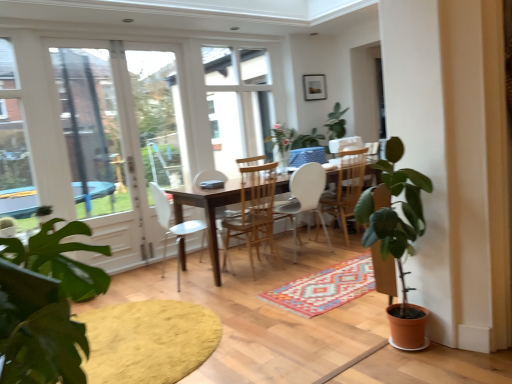
Image resolution: width=512 pixels, height=384 pixels. What do you see at coordinates (100, 153) in the screenshot?
I see `clear glass screen door at left` at bounding box center [100, 153].

Measure the distance between wooden chair at center, the 3th chair when ordered from right to left, and camera.

wooden chair at center, the 3th chair when ordered from right to left, and camera are 3.44 meters apart.

Image resolution: width=512 pixels, height=384 pixels. Identify the location of yellow felt mat at lower center. (149, 341).

At what (x,y) coordinates should I click in order to perform the action: click on clear glass screen door at left. Please return your answer as a coordinate pair (x, y). The height and width of the screenshot is (384, 512). Looking at the image, I should click on (100, 153).

Who is taller, wooden chair at center, the 3th chair when ordered from right to left, or white plastic chair at center, the 4th chair in the right-to-left sequence?

wooden chair at center, the 3th chair when ordered from right to left, is taller.

Considering the sizes of objects wooden chair at center, the 3th chair when ordered from right to left, and white plastic chair at center, the 4th chair in the right-to-left sequence, in the image provided, who is thinner, wooden chair at center, the 3th chair when ordered from right to left, or white plastic chair at center, the 4th chair in the right-to-left sequence,?

With smaller width is white plastic chair at center, the 4th chair in the right-to-left sequence.

From the image's perspective, between wooden chair at center, the second chair in the left-to-right sequence, and white plastic chair at center, arranged as the 1th chair when viewed from the left, who is located below?

white plastic chair at center, arranged as the 1th chair when viewed from the left, from the image's perspective.

Which point is more forward, [261,221] or [201,246]?

The point [261,221] is in front.

In the image, is wooden chair at center, the 3th chair when ordered from right to left, positioned in front of or behind terracotta pot plant at right?

wooden chair at center, the 3th chair when ordered from right to left, is behind terracotta pot plant at right.

Is wooden chair at center, the 3th chair when ordered from right to left, positioned beyond the bounds of terracotta pot plant at right?

Indeed, wooden chair at center, the 3th chair when ordered from right to left, is completely outside terracotta pot plant at right.

Is there a large distance between yellow textured rug at lower left and clear glass window at center?

Yes, yellow textured rug at lower left and clear glass window at center are quite far apart.

At what (x,y) coordinates should I click in order to perform the action: click on carpeting on the right of the clear glass window at center. Please return your answer as a coordinate pair (x, y). Looking at the image, I should click on (264, 314).

Is yellow textured rug at lower left to the left of clear glass window at center from the viewer's perspective?

Incorrect, yellow textured rug at lower left is not on the left side of clear glass window at center.

Relative to clear glass window at center, is yellow textured rug at lower left in front or behind?

In the image, yellow textured rug at lower left appears in front of clear glass window at center.

Does white matte chair at center, which appears as the third chair when viewed from the left, lie behind yellow felt mat at lower center?

Yes, white matte chair at center, which appears as the third chair when viewed from the left, is further from the viewer.

Consider the image. Is white matte chair at center, the 2th chair from the right, with yellow felt mat at lower center?

No, white matte chair at center, the 2th chair from the right, is not touching yellow felt mat at lower center.

Measure the distance from white matte chair at center, which appears as the third chair when viewed from the left, to yellow felt mat at lower center.

They are 5.44 feet apart.

Does white matte chair at center, the 2th chair from the right, have a lesser width compared to yellow felt mat at lower center?

Yes, white matte chair at center, the 2th chair from the right, is thinner than yellow felt mat at lower center.

Is wooden table at center taller than clear glass window at center?

No.

Which object is positioned more to the left, wooden table at center or clear glass window at center?

clear glass window at center.

You are a GUI agent. You are given a task and a screenshot of the screen. Output one action in this format:
    pyautogui.click(x=<x>, y=<y>)
    Task: Click on the window behind the wooden table at center
    This screenshot has height=384, width=512.
    Given the screenshot: What is the action you would take?
    pyautogui.click(x=237, y=104)

Is multicolored woven rug at center not inside matte wooden picture frame at upper center?

Yes, multicolored woven rug at center is not within matte wooden picture frame at upper center.

Which of these two, multicolored woven rug at center or matte wooden picture frame at upper center, stands taller?

matte wooden picture frame at upper center.

Is there a large distance between multicolored woven rug at center and matte wooden picture frame at upper center?

Absolutely, multicolored woven rug at center is distant from matte wooden picture frame at upper center.

Is terracotta pot plant at right closer to camera compared to white plastic chair at center, the 4th chair in the right-to-left sequence?

That is True.

Does terracotta pot plant at right contain white plastic chair at center, arranged as the 1th chair when viewed from the left?

Definitely not — white plastic chair at center, arranged as the 1th chair when viewed from the left, is not inside terracotta pot plant at right.

Based on the photo, from a real-world perspective, is terracotta pot plant at right above or below white plastic chair at center, arranged as the 1th chair when viewed from the left?

terracotta pot plant at right is above white plastic chair at center, arranged as the 1th chair when viewed from the left.

Is point (390, 182) less distant than point (198, 229)?

Yes, it is in front of point (198, 229).

This screenshot has height=384, width=512. Identify the location of the 1st chair above the white plastic chair at center, the 4th chair in the right-to-left sequence (from the image's perspective). (254, 212).

Locate an element on the screen. This screenshot has width=512, height=384. houseplant on the right of wooden chair at center, the 3th chair when ordered from right to left is located at coordinates (397, 236).

Looking at this image, considering their positions, is terracotta pot plant at right positioned further to white matte chair at center, which is counted as the 1th chair, starting from the right, than white plastic chair at center, arranged as the 1th chair when viewed from the left?

Among the two, terracotta pot plant at right is located further to white matte chair at center, which is counted as the 1th chair, starting from the right.

Looking at the image, which one is located closer to terracotta pot plant at right, wooden chair at center, the second chair in the left-to-right sequence, or clear glass window at center?

wooden chair at center, the second chair in the left-to-right sequence, lies closer to terracotta pot plant at right than the other object.

Based on their spatial positions, is yellow felt mat at lower center or multicolored woven rug at center closer to white matte chair at center, the 2th chair from the right?

multicolored woven rug at center is closer to white matte chair at center, the 2th chair from the right.

Considering their positions, is matte wooden picture frame at upper center positioned closer to yellow felt mat at lower center than white matte chair at center, acting as the 4th chair starting from the left?

white matte chair at center, acting as the 4th chair starting from the left, is positioned closer to the anchor yellow felt mat at lower center.

From the image, which object appears to be farther from wooden chair at center, the 3th chair when ordered from right to left, clear glass window at center or clear glass screen door at left?

clear glass screen door at left.

Looking at the image, which one is located closer to white matte chair at center, which appears as the third chair when viewed from the left, clear glass screen door at left or yellow textured rug at lower left?

yellow textured rug at lower left is positioned closer to the anchor white matte chair at center, which appears as the third chair when viewed from the left.

Looking at the image, which one is located closer to multicolored woven rug at center, clear glass screen door at left or terracotta pot plant at right?

Among the two, terracotta pot plant at right is located nearer to multicolored woven rug at center.

Estimate the real-world distances between objects in this image. Which object is closer to clear glass screen door at left, clear glass window at center or white plastic chair at center, the 4th chair in the right-to-left sequence?

white plastic chair at center, the 4th chair in the right-to-left sequence, is positioned closer to the anchor clear glass screen door at left.

Identify the location of mat between clear glass screen door at left and wooden table at center in the horizontal direction. (149, 341).

What are the coordinates of `desk between clear glass window at center and multicolored woven rug at center from top to bottom` in the screenshot? It's located at (207, 211).

What are the coordinates of `window between white matte chair at center, the 2th chair from the right, and matte wooden picture frame at upper center, along the z-axis` in the screenshot? It's located at (237, 104).

This screenshot has height=384, width=512. I want to click on carpets positioned between yellow textured rug at lower left and white plastic chair at center, arranged as the 1th chair when viewed from the left, from near to far, so click(325, 288).